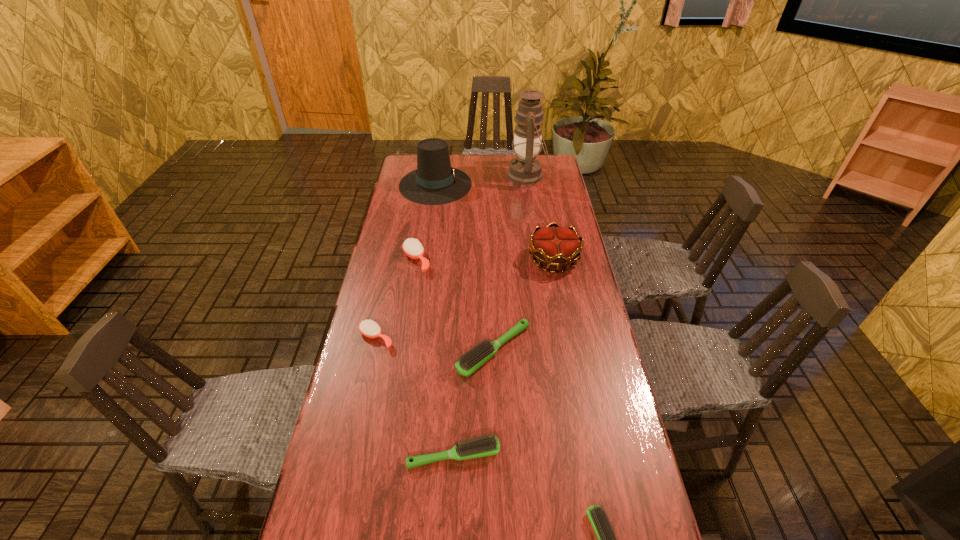
Locate an element on the screen. This screenshot has width=960, height=540. blank region between the crown and the smaller orange hairbrush is located at coordinates (465, 299).

Where is `empty location between the second nearest object and the crown`? empty location between the second nearest object and the crown is located at coordinates (504, 357).

Identify the location of vacant space that's between the second tallest object and the smaller orange hairbrush. tap(406, 261).

This screenshot has height=540, width=960. Identify the location of the fourth closest object to the biggest light hairbrush. (412, 248).

Locate an element on the screen. The width and height of the screenshot is (960, 540). object that can be found as the sixth closest to the second biggest light hairbrush is located at coordinates (434, 182).

Identify which hairbrush is the third closest to the farthest light hairbrush. Please provide its 2D coordinates. Your answer should be formatted as a tuple, i.e. [(x, y)], where the tuple contains the x and y coordinates of a point satisfying the conditions above.

[(412, 248)]

Find the location of `hairbrush that is the third closest to the farthest light hairbrush`. hairbrush that is the third closest to the farthest light hairbrush is located at coordinates (412, 248).

Select which light hairbrush appears as the closest to the tallest object. Please provide its 2D coordinates. Your answer should be formatted as a tuple, i.e. [(x, y)], where the tuple contains the x and y coordinates of a point satisfying the conditions above.

[(473, 359)]

Image resolution: width=960 pixels, height=540 pixels. Identify the location of light hairbrush that stands as the second closest to the brown oil lamp. (485, 446).

This screenshot has height=540, width=960. In order to click on free region that satisfies the following two spatial constraints: 1. on the front-facing side of the second nearest hairbrush; 2. on the right side of the gray hat in this screenshot , I will do `click(397, 455)`.